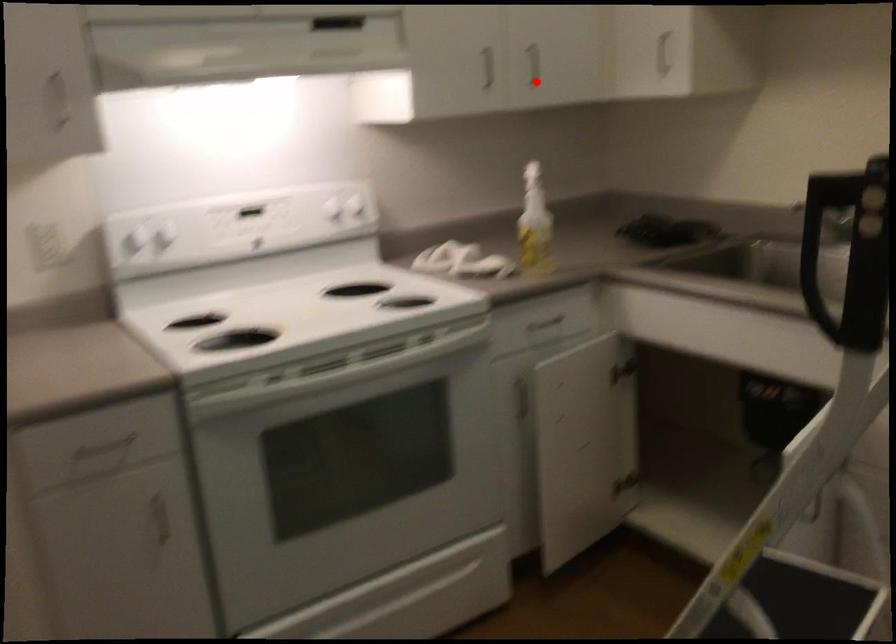
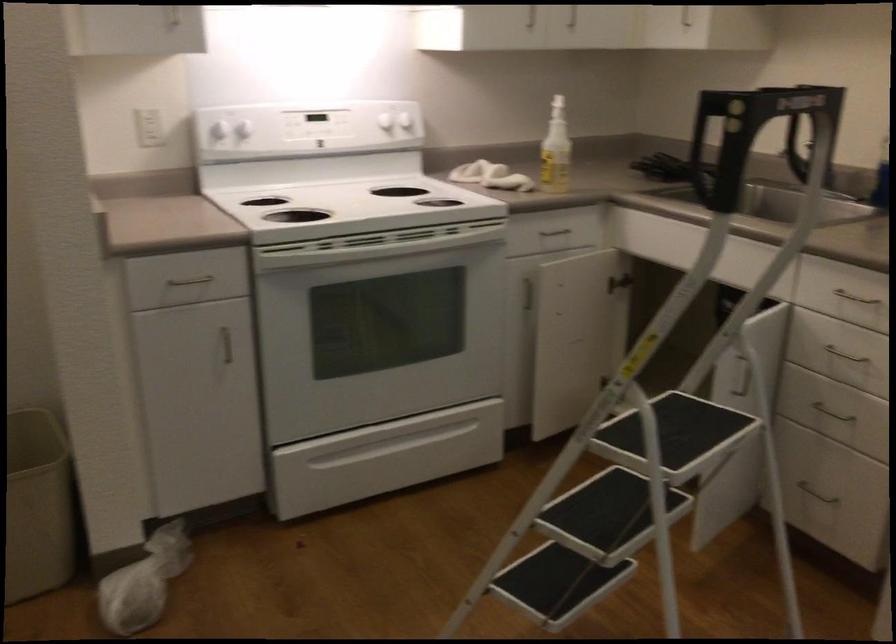
Where in the second image is the point corresponding to the highlighted location from the first image?

(573, 24)